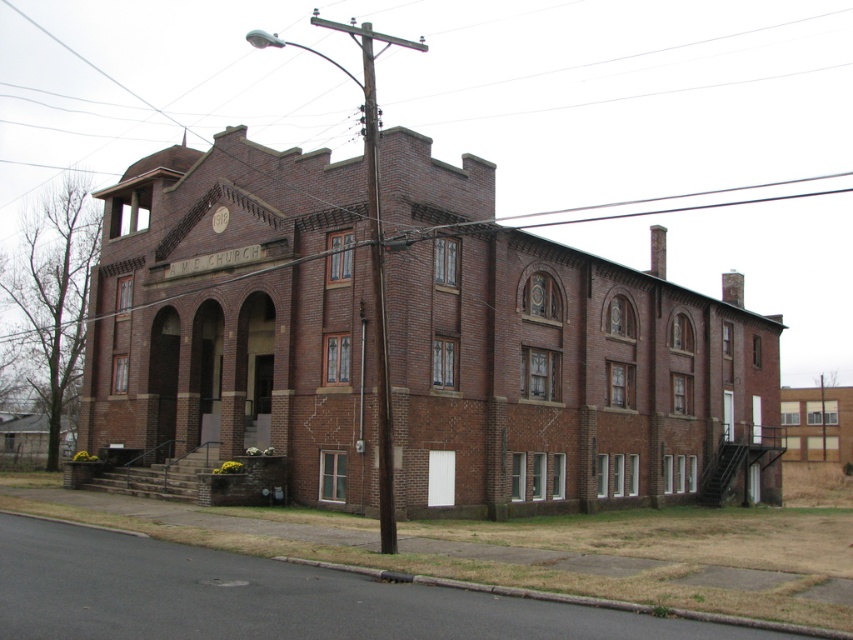
You are a delivery person standing in front of the A.M.E. CHURCH building. You need to place a package between the brown brick utility pole at center and the brown wooden utility pole at center. What is the minimum width of the package that can fit between them without touching either pole?

The minimum width of the package should be less than 1.57 meters to fit between the brown brick utility pole at center and the brown wooden utility pole at center without touching either pole.

You are standing in front of the A.M.E. CHURCH and need to locate both the brown brick utility pole at center and the brown wooden utility pole at center. From your perspective, which utility pole is positioned to the left?

The brown brick utility pole at center is positioned to the left of the brown wooden utility pole at center.